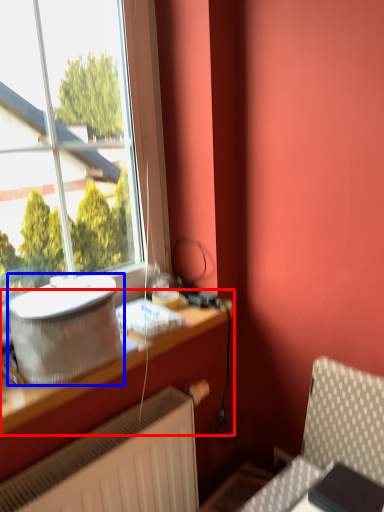
Question: Which object appears farthest to the camera in this image, table (highlighted by a red box) or appliance (highlighted by a blue box)?

Choices:
 (A) table
 (B) appliance

Answer: (B)